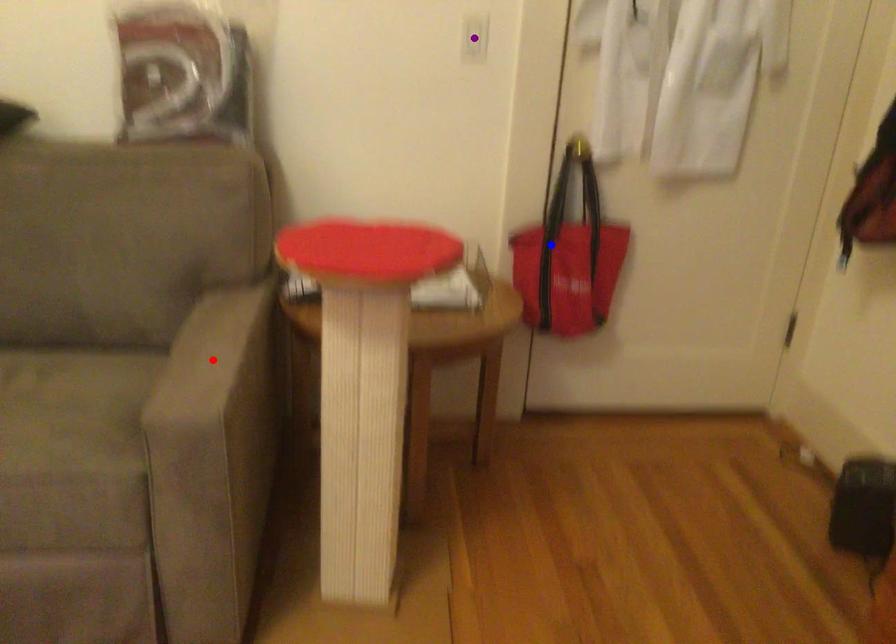
Order these from nearest to farthest:
1. purple point
2. blue point
3. red point

red point < purple point < blue point